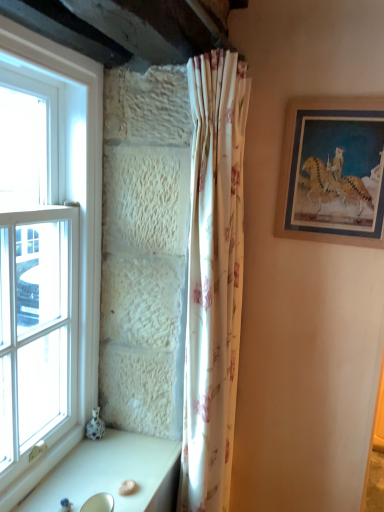
Question: Considering the relative sizes of white floral fabric curtain at center and white glossy table at lower left in the image provided, is white floral fabric curtain at center bigger than white glossy table at lower left?

Choices:
 (A) no
 (B) yes

Answer: (B)

Question: Can you confirm if white floral fabric curtain at center is positioned to the right of white glossy table at lower left?

Choices:
 (A) no
 (B) yes

Answer: (B)

Question: Is the position of white floral fabric curtain at center less distant than that of white glossy table at lower left?

Choices:
 (A) no
 (B) yes

Answer: (A)

Question: Does white floral fabric curtain at center touch white glossy table at lower left?

Choices:
 (A) no
 (B) yes

Answer: (A)

Question: Is white glossy table at lower left a part of white floral fabric curtain at center?

Choices:
 (A) no
 (B) yes

Answer: (A)

Question: In the image, is white glossy sink at lower left positioned in front of or behind white glossy table at lower left?

Choices:
 (A) behind
 (B) front

Answer: (B)

Question: Is point (61, 505) positioned closer to the camera than point (72, 487)?

Choices:
 (A) closer
 (B) farther

Answer: (A)

Question: Is white glossy sink at lower left spatially inside white glossy table at lower left, or outside of it?

Choices:
 (A) outside
 (B) inside

Answer: (A)

Question: From the image's perspective, is white glossy sink at lower left positioned above or below white glossy table at lower left?

Choices:
 (A) below
 (B) above

Answer: (B)

Question: Considering the positions of white glossy table at lower left and white glossy sink at lower left in the image, is white glossy table at lower left bigger or smaller than white glossy sink at lower left?

Choices:
 (A) big
 (B) small

Answer: (A)

Question: Which is correct: white glossy table at lower left is inside white glossy sink at lower left, or outside of it?

Choices:
 (A) outside
 (B) inside

Answer: (A)

Question: Considering the positions of white glossy table at lower left and white glossy sink at lower left in the image, is white glossy table at lower left wider or thinner than white glossy sink at lower left?

Choices:
 (A) thin
 (B) wide

Answer: (B)

Question: Is point (41, 505) positioned closer to the camera than point (99, 500)?

Choices:
 (A) closer
 (B) farther

Answer: (A)

Question: Looking at their shapes, would you say white glass window at left is wider or thinner than white floral fabric curtain at center?

Choices:
 (A) wide
 (B) thin

Answer: (B)

Question: Considering the positions of point (77, 392) and point (238, 106), is point (77, 392) closer or farther from the camera than point (238, 106)?

Choices:
 (A) closer
 (B) farther

Answer: (B)